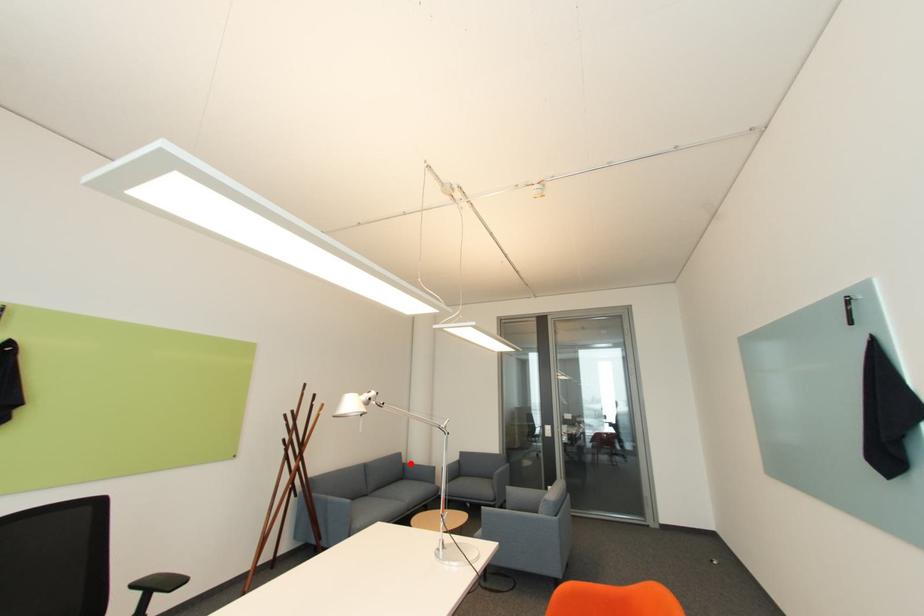
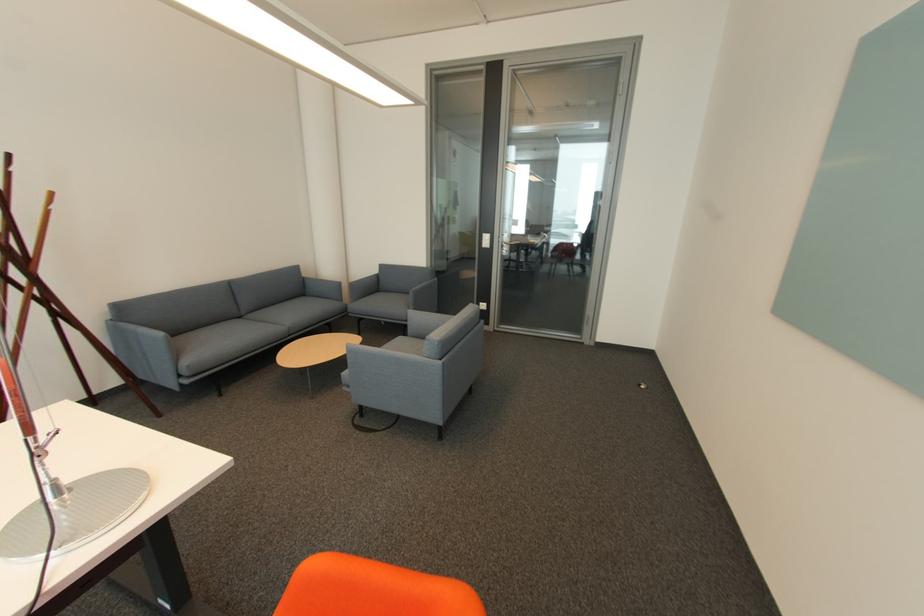
In the second image, find the point that corresponds to the highlighted location in the first image.

(310, 278)